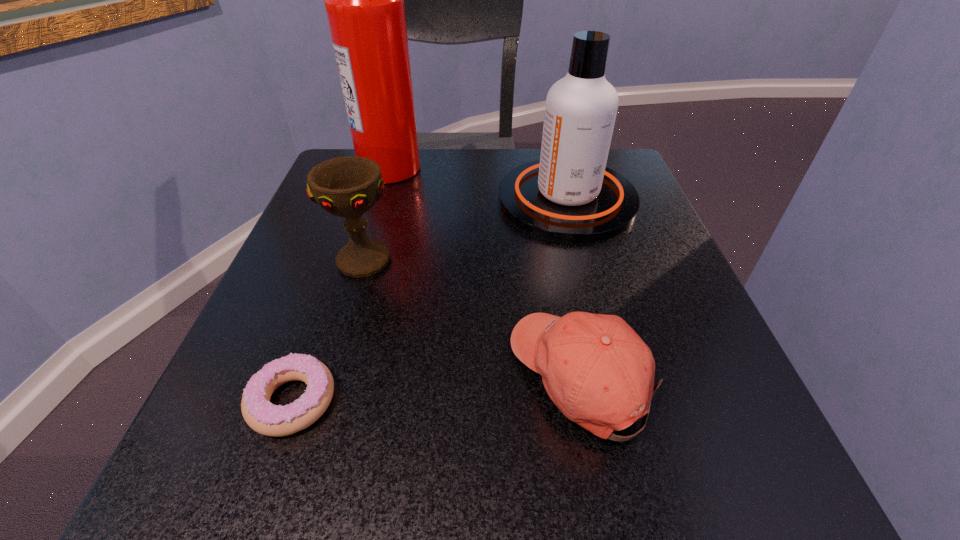
Identify the location of the tallest object. The width and height of the screenshot is (960, 540). (364, 0).

Image resolution: width=960 pixels, height=540 pixels. What are the coordinates of `the second tallest object` in the screenshot? It's located at (569, 195).

Find the location of a particular element. chalice is located at coordinates (349, 186).

Where is `baseball cap`? baseball cap is located at coordinates (596, 369).

Identify the location of doughnut. (260, 414).

You are a GUI agent. You are given a task and a screenshot of the screen. Output one action in this format:
    pyautogui.click(x=<x>, y=<y>)
    Task: Click on the free space located 0.220m at the nozzle of the fire extinguisher
    The image size is (960, 540).
    Given the screenshot: What is the action you would take?
    pyautogui.click(x=516, y=168)

This screenshot has width=960, height=540. What are the coordinates of `free region located on the left of the cleansing agent` in the screenshot? It's located at (460, 200).

Find the location of a particular element. This screenshot has height=540, width=960. vacant region located 0.130m on the right of the chalice is located at coordinates (471, 260).

You are a GUI agent. You are given a task and a screenshot of the screen. Output one action in this format:
    pyautogui.click(x=<x>, y=<y>)
    Task: Click on the vacant area located on the back of the baseball cap
    This screenshot has width=960, height=540.
    Given the screenshot: What is the action you would take?
    pyautogui.click(x=547, y=207)

Find the location of a particular element. Image resolution: width=960 pixels, height=540 pixels. free spot located on the right of the shortest object is located at coordinates (428, 401).